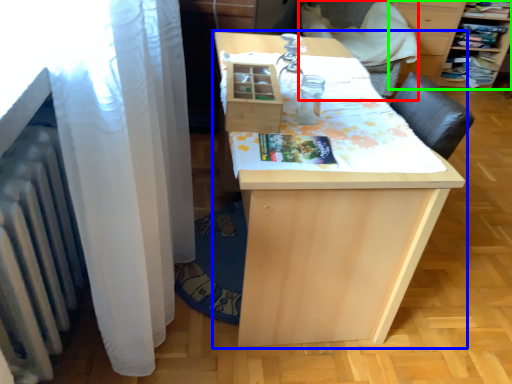
Question: Which object is the farthest from armchair (highlighted by a red box)? Choose among these: table (highlighted by a blue box) or furniture (highlighted by a green box).

Choices:
 (A) table
 (B) furniture

Answer: (A)